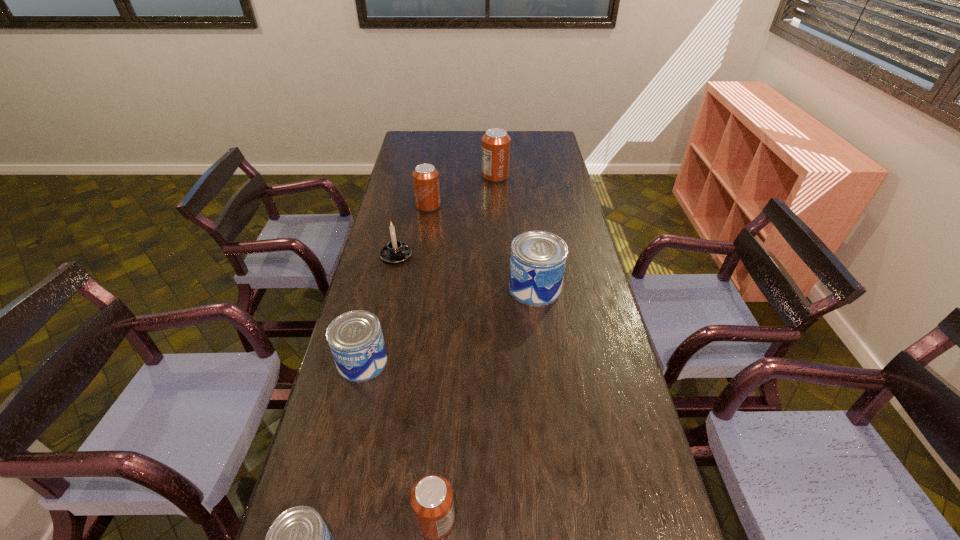
The height and width of the screenshot is (540, 960). In the image, there is a desktop. In order to click on vacant space at the right edge in this screenshot , I will do `click(591, 403)`.

Where is `free location at the far left corner`? Image resolution: width=960 pixels, height=540 pixels. free location at the far left corner is located at coordinates (409, 134).

Find the location of `blank space at the far right corner of the desktop`. blank space at the far right corner of the desktop is located at coordinates (549, 140).

Locate an element on the screen. vacant space that is in between the candle holder and the second farthest can is located at coordinates (412, 231).

At what (x,y) coordinates should I click in order to perform the action: click on free space between the third farthest object and the second smallest blue can. Please return your answer as a coordinate pair (x, y). The height and width of the screenshot is (540, 960). Looking at the image, I should click on (379, 308).

At what (x,y) coordinates should I click in order to perform the action: click on vacant area that lies between the fifth farthest object and the tallest object. Please return your answer as a coordinate pair (x, y). Image resolution: width=960 pixels, height=540 pixels. Looking at the image, I should click on tap(429, 269).

Identify which object is located as the second nearest to the farthest can. Please provide its 2D coordinates. Your answer should be formatted as a tuple, i.e. [(x, y)], where the tuple contains the x and y coordinates of a point satisfying the conditions above.

[(395, 251)]

Locate an element on the screen. Image resolution: width=960 pixels, height=540 pixels. object that can be found as the seventh closest to the nearest blue can is located at coordinates (496, 142).

Identify which can is the fourth nearest to the farthest can. Please provide its 2D coordinates. Your answer should be formatted as a tuple, i.e. [(x, y)], where the tuple contains the x and y coordinates of a point satisfying the conditions above.

[(431, 497)]

I want to click on can identified as the second closest to the smallest orange can, so click(x=298, y=539).